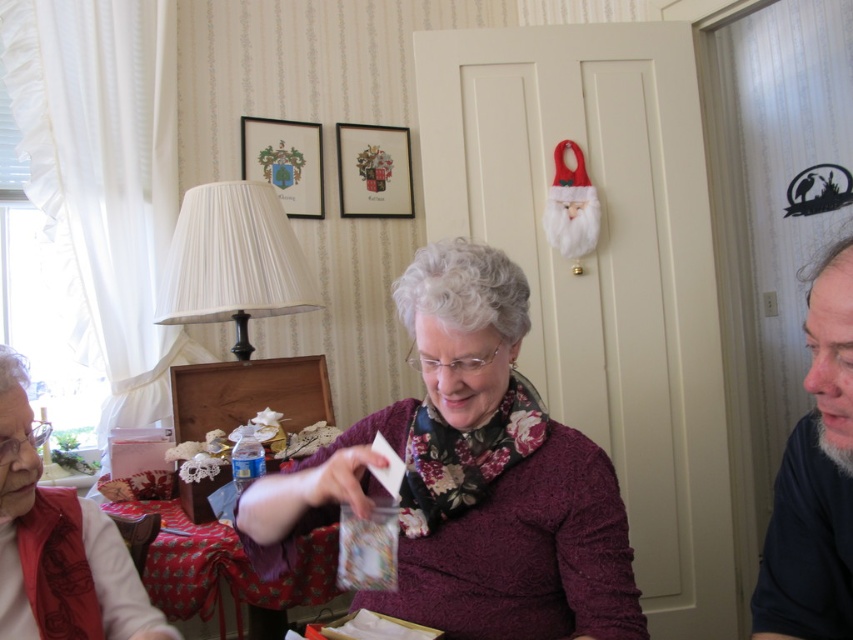
Is gray beard at right closer to the viewer compared to matte purple sweater at center?

Yes.

Between gray beard at right and matte purple sweater at center, which one has more height?

Standing taller between the two is gray beard at right.

Describe the element at coordinates (815, 477) in the screenshot. This screenshot has width=853, height=640. I see `gray beard at right` at that location.

Image resolution: width=853 pixels, height=640 pixels. Identify the location of gray beard at right. (815, 477).

Does matte purple sweater at center appear over red fabric tablecloth at lower center?

Indeed, matte purple sweater at center is positioned over red fabric tablecloth at lower center.

Based on the photo, is matte purple sweater at center in front of red fabric tablecloth at lower center?

That is True.

Between point (115, 556) and point (171, 502), which one is positioned in front?

Point (115, 556) is more forward.

The width and height of the screenshot is (853, 640). Find the location of `matte purple sweater at center`. matte purple sweater at center is located at coordinates (57, 545).

Is purple textured sweater at center to the left of matte purple sweater at center from the viewer's perspective?

No, purple textured sweater at center is not to the left of matte purple sweater at center.

Does purple textured sweater at center have a greater width compared to matte purple sweater at center?

Yes.

Does point (438, 529) come closer to viewer compared to point (155, 620)?

Yes.

At what (x,y) coordinates should I click in order to perform the action: click on purple textured sweater at center. Please return your answer as a coordinate pair (x, y). Looking at the image, I should click on (469, 477).